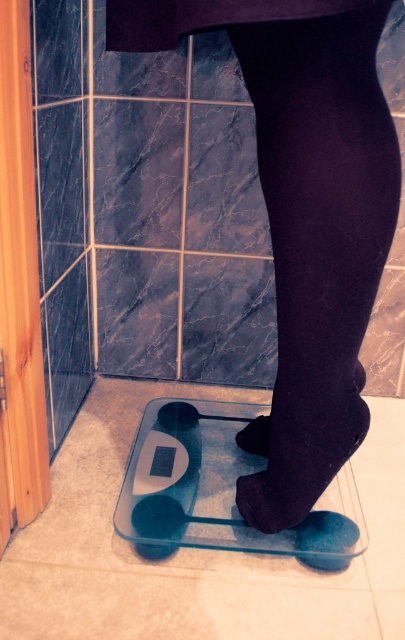
From the picture: Which is below, matte black boot at center or matte black shoe at center?

matte black shoe at center is below.

Is point (275, 516) in front of point (251, 426)?

Yes, point (275, 516) is closer to viewer.

Is point (341, 460) less distant than point (251, 426)?

That is True.

Where is `matte black boot at center`? The width and height of the screenshot is (405, 640). matte black boot at center is located at coordinates (294, 461).

Based on the photo, between black velvet tights at lower center and matte black boot at center, which one appears on the left side from the viewer's perspective?

From the viewer's perspective, black velvet tights at lower center appears more on the left side.

The width and height of the screenshot is (405, 640). Find the location of `black velvet tights at lower center`. black velvet tights at lower center is located at coordinates (304, 212).

Find the location of a particular element. Image resolution: width=405 pixels, height=640 pixels. black velvet tights at lower center is located at coordinates (304, 212).

Between point (330, 35) and point (247, 440), which one is positioned in front?

Point (330, 35) is more forward.

Which is behind, point (294, 177) or point (245, 436)?

The point (245, 436) is more distant.

What do you see at coordinates (304, 212) in the screenshot? The image size is (405, 640). I see `black velvet tights at lower center` at bounding box center [304, 212].

Where is `black velvet tights at lower center`? This screenshot has width=405, height=640. black velvet tights at lower center is located at coordinates (304, 212).